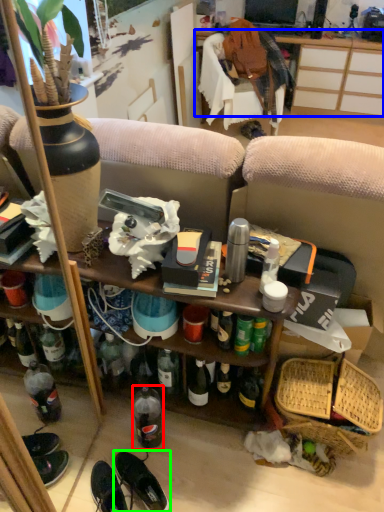
Question: Which is farther away from bottle (highlighted by a red box)? desk (highlighted by a blue box) or footwear (highlighted by a green box)?

Choices:
 (A) desk
 (B) footwear

Answer: (A)